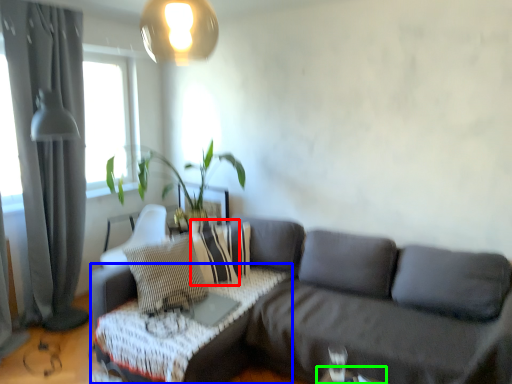
Question: Which object is the farthest from pillow (highlighted by a red box)? Choose among these: table (highlighted by a blue box) or table (highlighted by a green box).

Choices:
 (A) table
 (B) table

Answer: (B)